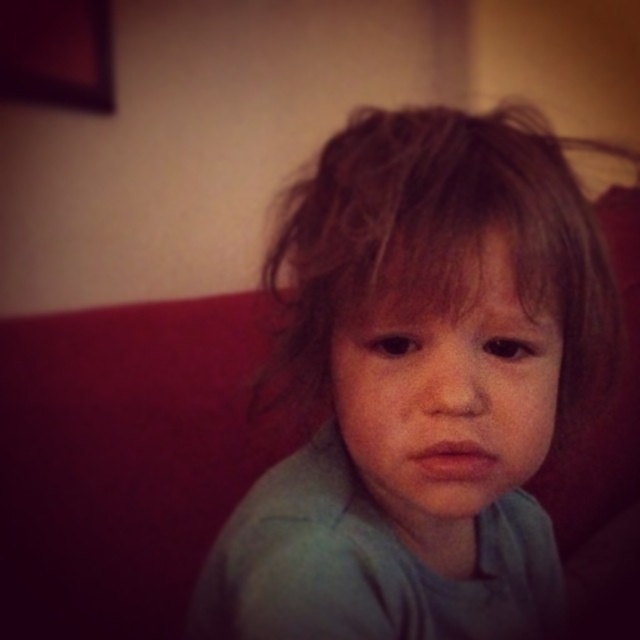
Consider the image. You are a photographer who wants to ensure the light blue fabric at center and the smooth skin face at center are both visible in the photo. Given their sizes, which one should you adjust the camera focus to prioritize to ensure both are in frame?

The light blue fabric at center is taller than the smooth skin face at center, so you should adjust the camera focus to prioritize the light blue fabric at center to ensure both are in frame.